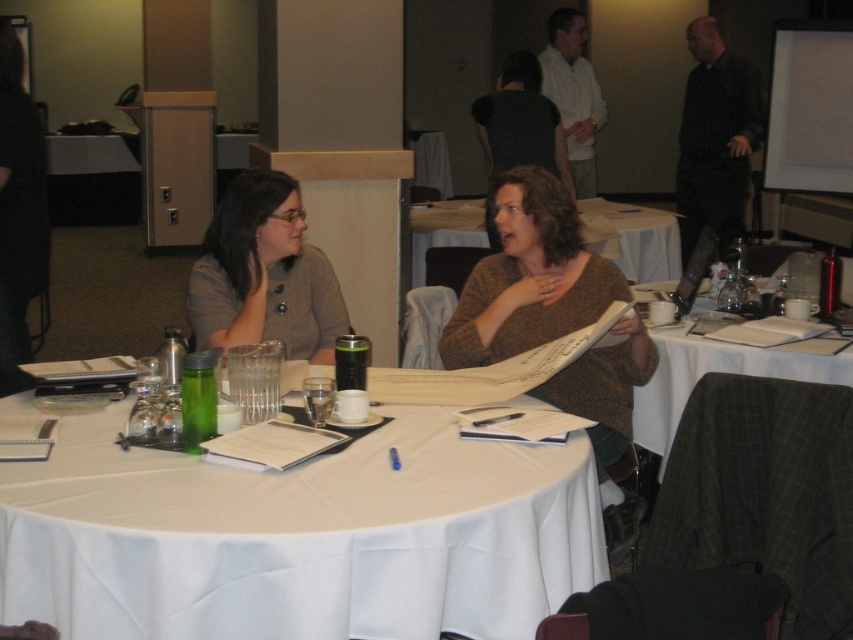
You are organizing a small event and need to place a decorative centerpiece on the table. Given the current setup, where should you place it to ensure it is centered between the white fabric table at lower right and the white paper at center?

The white fabric table at lower right is to the left of the white paper at center, so the center between them would be closer to the white paper at center. Place the centerpiece slightly to the right of the white fabric table at lower right to center it between both objects.

You are organizing a presentation and need to place the matte gray sweater at center and the white paper at center on a shelf. Which object should be placed first if you want to arrange them from shortest to tallest?

The matte gray sweater at center is shorter than the white paper at center, so you should place the matte gray sweater at center first when arranging from shortest to tallest.

Consider the image. What are the coordinates of the matte gray sweater at center?

The coordinates of the matte gray sweater at center are (264,275).